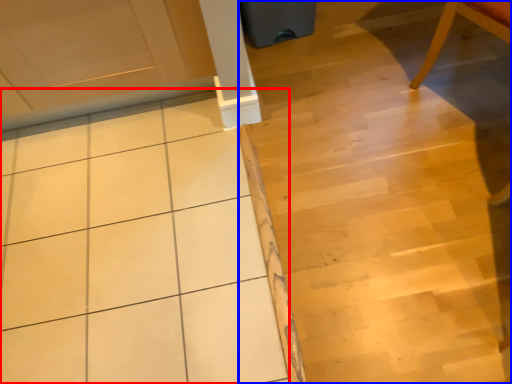
Question: Which object is closer to the camera taking this photo, ceramic tile (highlighted by a red box) or stair (highlighted by a blue box)?

Choices:
 (A) ceramic tile
 (B) stair

Answer: (B)